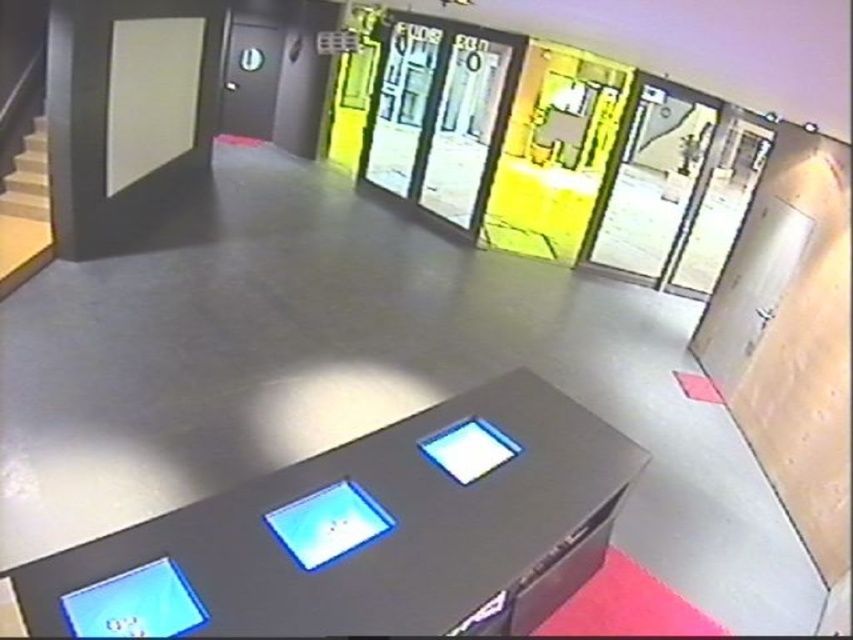
You are a security guard standing at the entrance of the hallway. You need to reach both the point at (x=334, y=513) and the point at (x=15, y=182) to check for any irregularities. Which point should you check first if you want to start from the closest one?

You should check point (x=334, y=513) first because it is closer to your starting position at the entrance compared to point (x=15, y=182).

You are a delivery person trying to place a large package on the metallic gray table at center. The wooden stairs at left are in your way. Can you move the package around the stairs to reach the table?

The metallic gray table at center is larger in size than wooden stairs at left, so yes, you can move the package around the wooden stairs at left to reach the metallic gray table at center since the table is bigger and provides more space.

You are a delivery person carrying a large package that requires a cart to move. You need to place the cart between the metallic gray table at center and the wooden stairs at left. Is there enough space to fit the cart, which is 5 meters long, between them?

The metallic gray table at center and wooden stairs at left are 4.98 meters apart from each other, so there is not enough space to fit a 5 meter long cart between them.